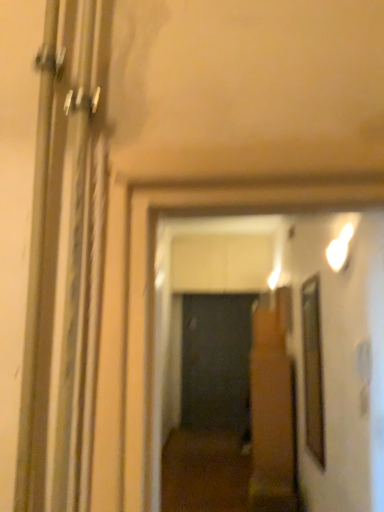
The image size is (384, 512). Find the location of `brown wooden floor at center`. brown wooden floor at center is located at coordinates (211, 475).

The image size is (384, 512). Describe the element at coordinates (211, 475) in the screenshot. I see `brown wooden floor at center` at that location.

At what (x,y) coordinates should I click in order to perform the action: click on brown wooden floor at center. Please return your answer as a coordinate pair (x, y). Looking at the image, I should click on (211, 475).